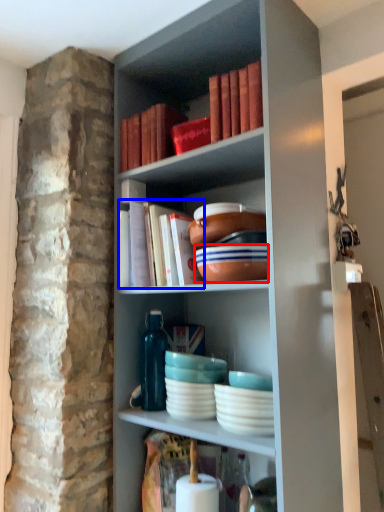
Question: Which object is further to the camera taking this photo, bowl (highlighted by a red box) or book (highlighted by a blue box)?

Choices:
 (A) bowl
 (B) book

Answer: (B)